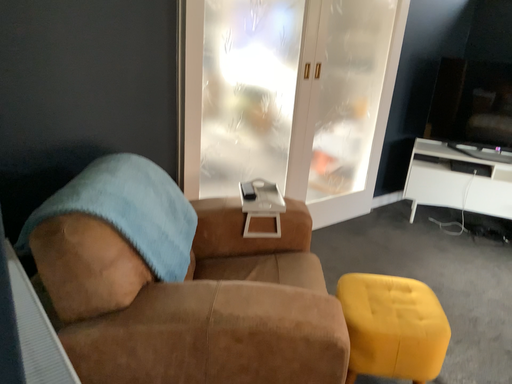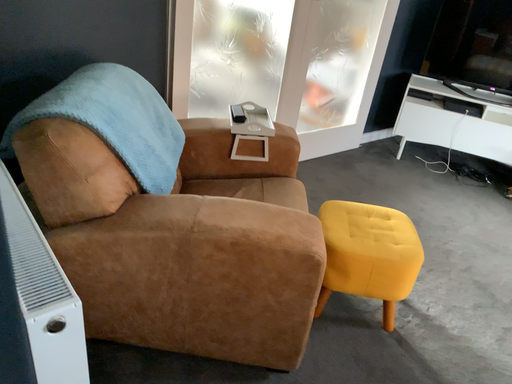
Question: How did the camera likely rotate when shooting the video?

Choices:
 (A) rotated downward
 (B) rotated upward

Answer: (A)